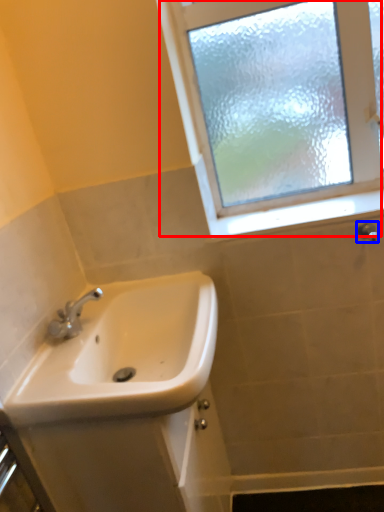
Question: Which of the following is the closest to the observer, window (highlighted by a red box) or shower (highlighted by a blue box)?

Choices:
 (A) window
 (B) shower

Answer: (A)